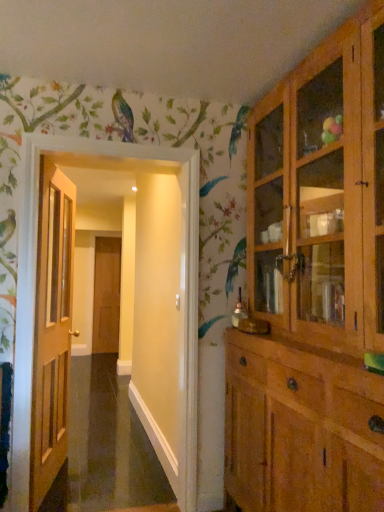
You are a GUI agent. You are given a task and a screenshot of the screen. Output one action in this format:
    pyautogui.click(x=<x>, y=<y>)
    Task: Click on the brown wooden door at center, placed as the 2th door when sorted from front to back
    The height and width of the screenshot is (512, 384).
    Given the screenshot: What is the action you would take?
    pyautogui.click(x=106, y=295)

The width and height of the screenshot is (384, 512). Identify the location of wooden door at left, the second door positioned from the back. (52, 329).

The image size is (384, 512). What do you see at coordinates (52, 329) in the screenshot?
I see `wooden door at left, which ranks as the first door in front-to-back order` at bounding box center [52, 329].

What is the approximate height of light brown wood cabinet at right?

light brown wood cabinet at right is 7.54 feet in height.

The image size is (384, 512). What do you see at coordinates (313, 287) in the screenshot?
I see `light brown wood cabinet at right` at bounding box center [313, 287].

The image size is (384, 512). I want to click on wooden door at left, so click(182, 262).

In the scene shown: Between wooden door at left and light brown wood cabinet at right, which one has larger width?

light brown wood cabinet at right is wider.

Is wooden door at left bigger than light brown wood cabinet at right?

Actually, wooden door at left might be smaller than light brown wood cabinet at right.

Does wooden door at left touch light brown wood cabinet at right?

No, wooden door at left is not touching light brown wood cabinet at right.

From a real-world perspective, is wooden door at left on top of light brown wood cabinet at right?

Actually, wooden door at left is physically below light brown wood cabinet at right in the real world.

Is light brown wood cabinet at right positioned far away from wooden door at left?

light brown wood cabinet at right is near wooden door at left, not far away.

Do you think light brown wood cabinet at right is within wooden door at left, or outside of it?

light brown wood cabinet at right is located beyond the bounds of wooden door at left.

Identify the location of corridor directly beneath the light brown wood cabinet at right (from a real-world perspective). (182, 262).

From a real-world perspective, is light brown wood cabinet at right physically above wooden door at left?

Yes, from a real-world perspective, light brown wood cabinet at right is over wooden door at left

Would you say wooden door at left, which ranks as the first door in front-to-back order, is inside or outside wooden door at left?

wooden door at left, which ranks as the first door in front-to-back order, is outside wooden door at left.

Considering the relative sizes of wooden door at left, marked as the first door in a right-to-left arrangement, and wooden door at left in the image provided, is wooden door at left, marked as the first door in a right-to-left arrangement, taller than wooden door at left?

In fact, wooden door at left, marked as the first door in a right-to-left arrangement, may be shorter than wooden door at left.

Does wooden door at left, which ranks as the first door in front-to-back order, touch wooden door at left?

wooden door at left, which ranks as the first door in front-to-back order, and wooden door at left are not in contact.

Is wooden door at left, which is the 2th door from left to right, oriented towards wooden door at left?

Yes, wooden door at left, which is the 2th door from left to right, is oriented towards wooden door at left.

Is wooden door at left at the back of brown wooden door at center, placed as the 2th door when sorted from front to back?

No, brown wooden door at center, placed as the 2th door when sorted from front to back, is not facing the opposite direction of wooden door at left.

Is brown wooden door at center, marked as the second door in a right-to-left arrangement, bigger than wooden door at left?

Actually, brown wooden door at center, marked as the second door in a right-to-left arrangement, might be smaller than wooden door at left.

Which point is more distant from viewer, (96, 246) or (195, 490)?

The point (96, 246) is behind.

In the scene shown: Considering the relative positions of brown wooden door at center, marked as the second door in a right-to-left arrangement, and wooden door at left in the image provided, is brown wooden door at center, marked as the second door in a right-to-left arrangement, to the right of wooden door at left from the viewer's perspective?

No, brown wooden door at center, marked as the second door in a right-to-left arrangement, is not to the right of wooden door at left.

From the image's perspective, between wooden door at left and wooden door at left, marked as the first door in a right-to-left arrangement, which one is located above?

wooden door at left.

Does wooden door at left have a lesser width compared to wooden door at left, marked as the first door in a right-to-left arrangement?

No.

Does wooden door at left have a lesser height compared to wooden door at left, which ranks as the first door in front-to-back order?

No, wooden door at left is not shorter than wooden door at left, which ranks as the first door in front-to-back order.

Considering the positions of points (34, 354) and (118, 302), is point (34, 354) farther from camera compared to point (118, 302)?

No, it is not.

Can you confirm if wooden door at left, marked as the first door in a right-to-left arrangement, is taller than brown wooden door at center, marked as the 1th door in a left-to-right arrangement?

Yes.

Is wooden door at left, which ranks as the first door in front-to-back order, located outside brown wooden door at center, marked as the 1th door in a left-to-right arrangement?

Yes, wooden door at left, which ranks as the first door in front-to-back order, is located beyond the bounds of brown wooden door at center, marked as the 1th door in a left-to-right arrangement.

Looking at this image, considering the relative sizes of wooden door at left, which is the 2th door from left to right, and brown wooden door at center, placed as the 2th door when sorted from front to back, in the image provided, is wooden door at left, which is the 2th door from left to right, wider than brown wooden door at center, placed as the 2th door when sorted from front to back,?

Indeed, wooden door at left, which is the 2th door from left to right, has a greater width compared to brown wooden door at center, placed as the 2th door when sorted from front to back.

Is wooden door at left, which ranks as the first door in front-to-back order, oriented away from light brown wood cabinet at right?

No.

From a real-world perspective, is wooden door at left, the second door positioned from the back, positioned above or below light brown wood cabinet at right?

wooden door at left, the second door positioned from the back, is situated lower than light brown wood cabinet at right in the real world.

Is wooden door at left, marked as the first door in a right-to-left arrangement, taller or shorter than light brown wood cabinet at right?

wooden door at left, marked as the first door in a right-to-left arrangement, is shorter than light brown wood cabinet at right.

Does point (68, 257) appear closer or farther from the camera than point (227, 438)?

Point (68, 257).

At what (x,y) coordinates should I click in order to perform the action: click on cabinetry in front of the wooden door at left. Please return your answer as a coordinate pair (x, y). The height and width of the screenshot is (512, 384). Looking at the image, I should click on (313, 287).

The width and height of the screenshot is (384, 512). I want to click on corridor on the left of the light brown wood cabinet at right, so click(x=182, y=262).

When comparing their distances from brown wooden door at center, marked as the 1th door in a left-to-right arrangement, does wooden door at left or light brown wood cabinet at right seem further?

light brown wood cabinet at right is further to brown wooden door at center, marked as the 1th door in a left-to-right arrangement.

Considering their positions, is light brown wood cabinet at right positioned further to wooden door at left than brown wooden door at center, marked as the 1th door in a left-to-right arrangement?

The object further to wooden door at left is brown wooden door at center, marked as the 1th door in a left-to-right arrangement.

From the image, which object appears to be nearer to light brown wood cabinet at right, brown wooden door at center, marked as the 1th door in a left-to-right arrangement, or wooden door at left?

Based on the image, wooden door at left appears to be nearer to light brown wood cabinet at right.

Estimate the real-world distances between objects in this image. Which object is closer to wooden door at left, wooden door at left, which is the 2th door from left to right, or brown wooden door at center, marked as the second door in a right-to-left arrangement?

→ The object closer to wooden door at left is wooden door at left, which is the 2th door from left to right.

Looking at this image, looking at the image, which one is located closer to wooden door at left, brown wooden door at center, marked as the second door in a right-to-left arrangement, or light brown wood cabinet at right?

light brown wood cabinet at right lies closer to wooden door at left than the other object.

Based on their spatial positions, is wooden door at left or wooden door at left, which is the 2th door from left to right, further from light brown wood cabinet at right?

wooden door at left, which is the 2th door from left to right, is further to light brown wood cabinet at right.

Looking at the image, which one is located closer to wooden door at left, brown wooden door at center, marked as the second door in a right-to-left arrangement, or wooden door at left, which is the 2th door from left to right?

The object closer to wooden door at left is wooden door at left, which is the 2th door from left to right.

In the scene shown: Estimate the real-world distances between objects in this image. Which object is further from wooden door at left, wooden door at left, which ranks as the first door in front-to-back order, or light brown wood cabinet at right?

light brown wood cabinet at right is positioned further to the anchor wooden door at left.

Locate an element on the screen. The height and width of the screenshot is (512, 384). door between wooden door at left and brown wooden door at center, marked as the 1th door in a left-to-right arrangement, in the front-back direction is located at coordinates (52, 329).

Identify the location of corridor located between light brown wood cabinet at right and brown wooden door at center, marked as the second door in a right-to-left arrangement, in the depth direction. The image size is (384, 512). (182, 262).

Identify the location of door between light brown wood cabinet at right and brown wooden door at center, the 1th door from the back, from front to back. (x=52, y=329).

Image resolution: width=384 pixels, height=512 pixels. What are the coordinates of `corridor between wooden door at left, the second door positioned from the back, and light brown wood cabinet at right, in the horizontal direction` in the screenshot? It's located at (182, 262).